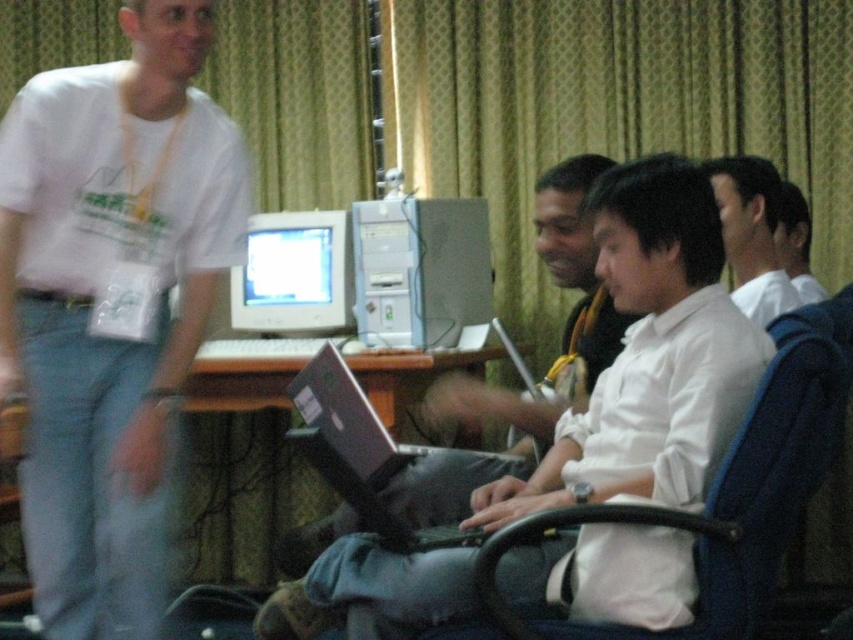
What object is located at the coordinates point (294, 275)?

The matte gray monitor at center is located at point (294, 275).

You are a photographer trying to capture a clear image of the matte gray computer tower at center and the matte gray monitor at center. Since the scene is slightly blurred due to motion, which object should you focus on first to ensure clarity, the one closer to you or the one further away?

The matte gray computer tower at center is to the right of matte gray monitor at center, but since both are at center, their distance from you is similar. Focus on either as they are likely at the same focal plane.